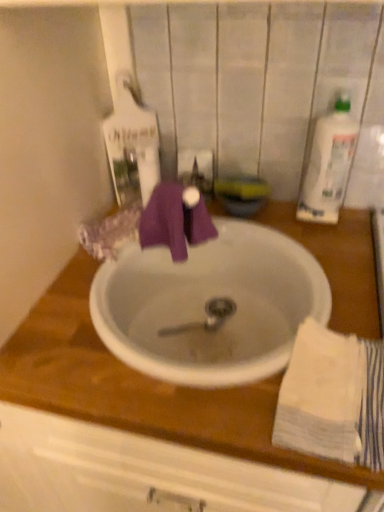
Question: Considering the positions of white ceramic sink at center and white plastic bottle at upper right in the image, is white ceramic sink at center taller or shorter than white plastic bottle at upper right?

Choices:
 (A) short
 (B) tall

Answer: (A)

Question: Looking at the image, does white ceramic sink at center seem bigger or smaller compared to white plastic bottle at upper right?

Choices:
 (A) big
 (B) small

Answer: (A)

Question: Based on their relative distances, which object is farther from the white plastic bottle at upper right?

Choices:
 (A) white ceramic sink at center
 (B) white cotton towel at lower right

Answer: (B)

Question: Based on their relative distances, which object is farther from the white plastic bottle at upper right?

Choices:
 (A) white cotton towel at lower right
 (B) white ceramic sink at center

Answer: (A)